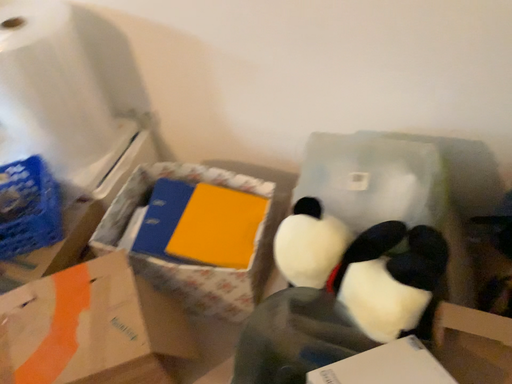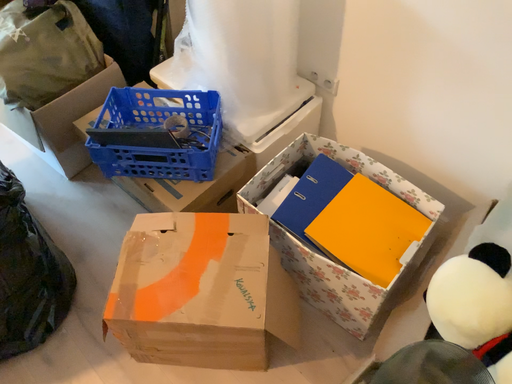
Question: How did the camera likely rotate when shooting the video?

Choices:
 (A) rotated right
 (B) rotated left

Answer: (B)